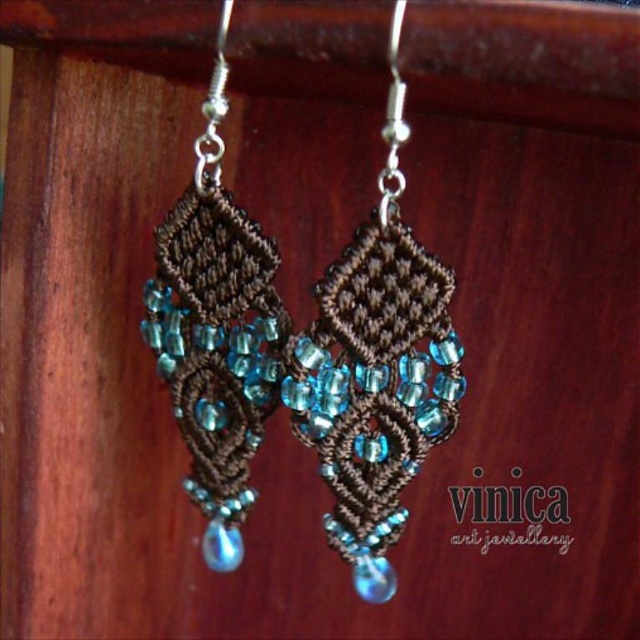
You are an artisan preparing to package two pairs of matte brown macrame earrings. The packaging box you have is 4 inches wide. Can you place both the matte brown macrame earrings at center and the matte brown macrame earrings at left side by side inside the box without overlapping?

The distance between the matte brown macrame earrings at center and the matte brown macrame earrings at left is 4.68 inches. Since the box is only 4 inches wide, the two earrings cannot fit side by side without overlapping.

You are an interior designer organizing a jewelry display. You have two matte brown macrame earrings at center and matte brown macrame earrings at left. Which one would you choose to place in a smaller display case to ensure it fits properly?

The matte brown macrame earrings at center occupies less space than the matte brown macrame earrings at left, so it would fit better in a smaller display case.

You are a jewelry designer who wants to create a matching necklace. You have two matte brown macrame earrings at center and matte brown macrame earrings at left in front of you. Which earring should you choose as the main design element for the necklace if you want the necklace to have a wider appearance?

The matte brown macrame earrings at center should be chosen because its width is larger than the matte brown macrame earrings at left.